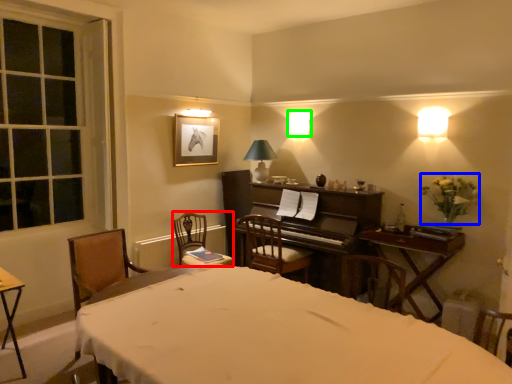
Question: Which object is the farthest from chair (highlighted by a red box)? Choose among these: flower (highlighted by a blue box) or lamp (highlighted by a green box).

Choices:
 (A) flower
 (B) lamp

Answer: (A)